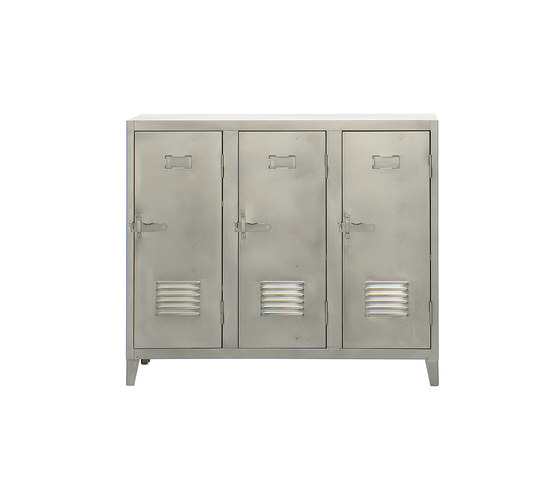
You are a GUI agent. You are given a task and a screenshot of the screen. Output one action in this format:
    pyautogui.click(x=<x>, y=<y>)
    Task: Click on the left door
    The height and width of the screenshot is (478, 560).
    Given the screenshot: What is the action you would take?
    pyautogui.click(x=200, y=252)